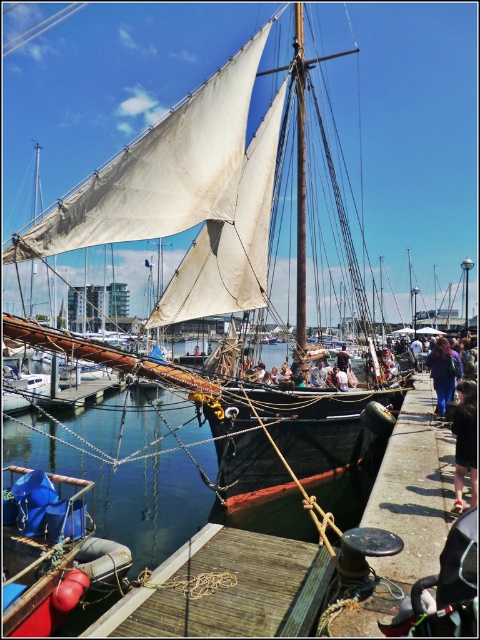
Does blue fabric bag at lower left have a smaller size compared to blue fabric at lower right?

Yes, blue fabric bag at lower left is smaller than blue fabric at lower right.

Is blue fabric bag at lower left to the left of blue fabric at lower right from the viewer's perspective?

Yes, blue fabric bag at lower left is to the left of blue fabric at lower right.

The height and width of the screenshot is (640, 480). Describe the element at coordinates (50, 552) in the screenshot. I see `blue fabric bag at lower left` at that location.

Identify the location of blue fabric bag at lower left. The height and width of the screenshot is (640, 480). (50, 552).

Does white canvas sailboat at center appear on the left side of blue fabric bag at lower left?

Indeed, white canvas sailboat at center is positioned on the left side of blue fabric bag at lower left.

Is point (288, 204) positioned after point (128, 563)?

Yes, it is.

Between point (127, 244) and point (51, 502), which one is positioned behind?

The point (127, 244) is behind.

This screenshot has width=480, height=640. I want to click on white canvas sailboat at center, so click(x=124, y=140).

Does point (195, 74) come behind point (343, 346)?

Yes, it is.

Identify the location of white canvas sailboat at center. This screenshot has width=480, height=640. (124, 140).

Where is `white canvas sailboat at center`? The width and height of the screenshot is (480, 640). white canvas sailboat at center is located at coordinates (124, 140).

Find the location of `white canvas sailboat at center`. white canvas sailboat at center is located at coordinates (124, 140).